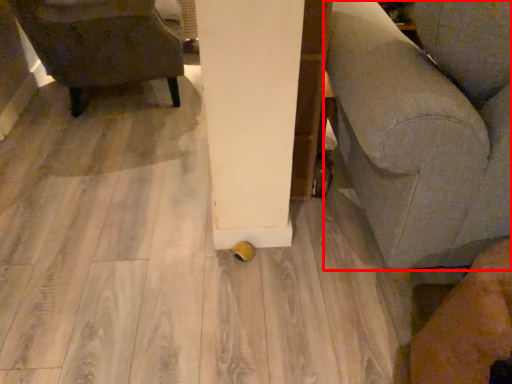
Question: From the image's perspective, where is furniture (annotated by the red box) located relative to chair?

Choices:
 (A) above
 (B) below

Answer: (B)